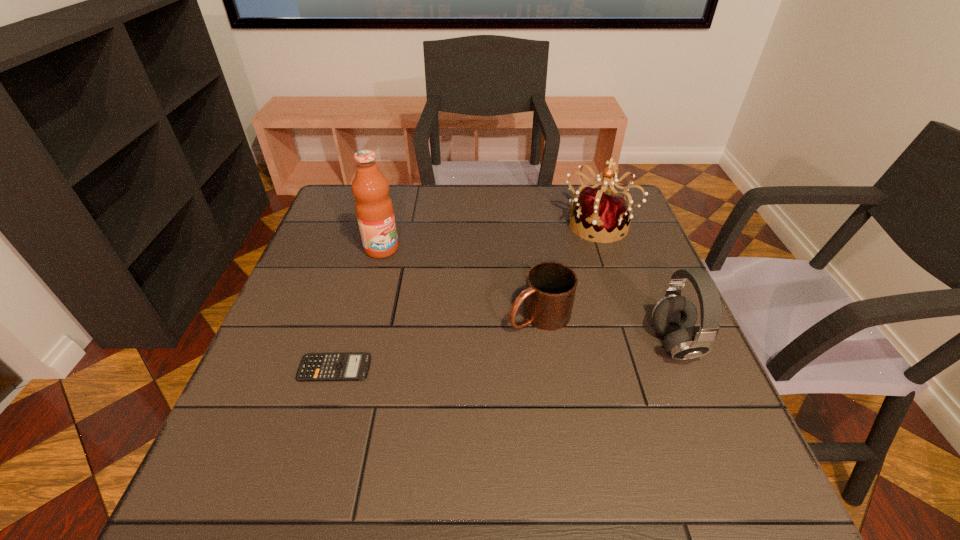
Where is `vacant region that satisfies the following two spatial constraints: 1. on the front side of the tiara; 2. on the ear cups of the headset`? vacant region that satisfies the following two spatial constraints: 1. on the front side of the tiara; 2. on the ear cups of the headset is located at coordinates (638, 343).